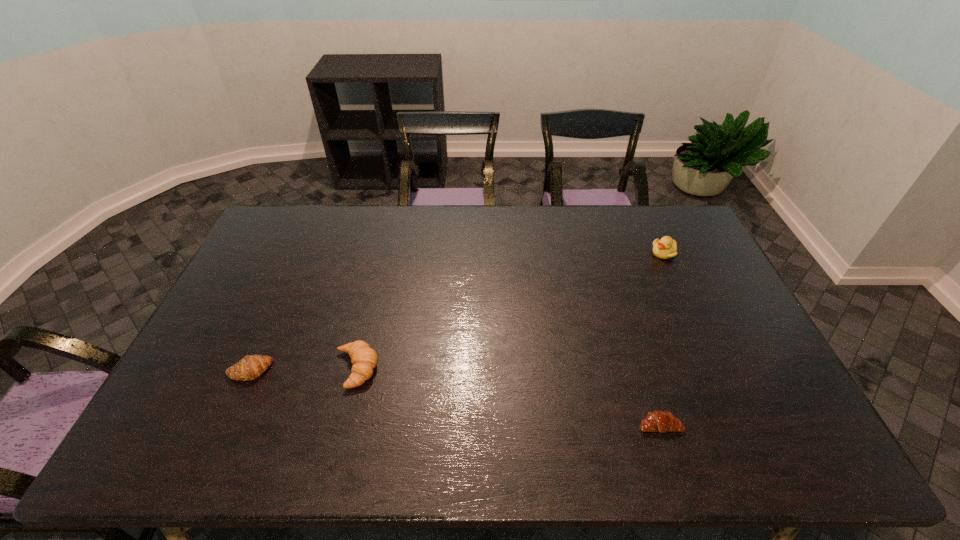
You are a GUI agent. You are given a task and a screenshot of the screen. Output one action in this format:
    pyautogui.click(x=<x>, y=<y>)
    Task: Click on the free space at the near edge of the desktop
    
    Given the screenshot: What is the action you would take?
    pyautogui.click(x=565, y=459)

Where is `vacant area at the left edge of the desktop`? The width and height of the screenshot is (960, 540). vacant area at the left edge of the desktop is located at coordinates (204, 408).

Identify the location of free space at the far left corner of the desktop. (283, 213).

In the image, there is a desktop. Identify the location of vacant space at the far right corner. (654, 211).

I want to click on blank area at the near right corner, so click(x=756, y=451).

At what (x,y) coordinates should I click in order to perform the action: click on free point between the second crescent roll from right to left and the leftmost crescent roll. Please return your answer as a coordinate pair (x, y). Looking at the image, I should click on (302, 370).

Locate an element on the screen. The height and width of the screenshot is (540, 960). vacant region between the rightmost object and the leftmost crescent roll is located at coordinates (457, 312).

Locate an element on the screen. The width and height of the screenshot is (960, 540). free spot between the second tallest crescent roll and the nearest crescent roll is located at coordinates (454, 397).

Identify the location of free space between the shortest object and the tallest object. This screenshot has height=540, width=960. (661, 339).

Where is `vacant area that lies between the second shortest crescent roll and the shortest object`? This screenshot has height=540, width=960. vacant area that lies between the second shortest crescent roll and the shortest object is located at coordinates (454, 397).